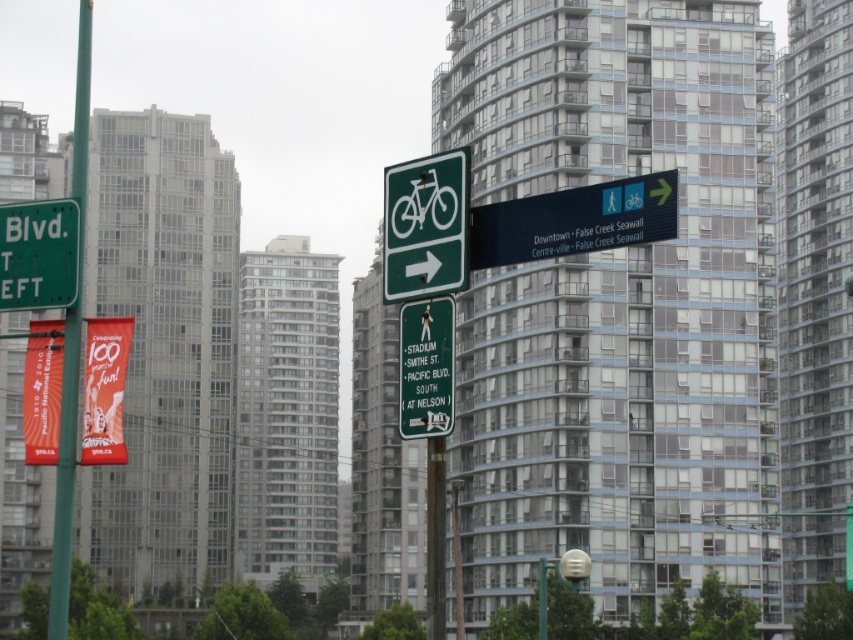
Question: Which object appears farthest from the camera in this image?

Choices:
 (A) green metallic pole at left
 (B) green matte sign at upper left
 (C) green matte sign at center

Answer: (B)

Question: Which object is closer to the camera taking this photo?

Choices:
 (A) dark blue plastic sign at center
 (B) green matte bicycle at center

Answer: (A)

Question: Is green matte bicycle at center thinner than green metallic pole at left?

Choices:
 (A) yes
 (B) no

Answer: (A)

Question: Which point is closer to the camera?

Choices:
 (A) green metallic pole at left
 (B) dark blue plastic sign at center

Answer: (B)

Question: Does green matte sign at upper left come behind green matte sign at center?

Choices:
 (A) no
 (B) yes

Answer: (B)

Question: Is dark blue plastic sign at center behind green metallic pole at left?

Choices:
 (A) no
 (B) yes

Answer: (A)